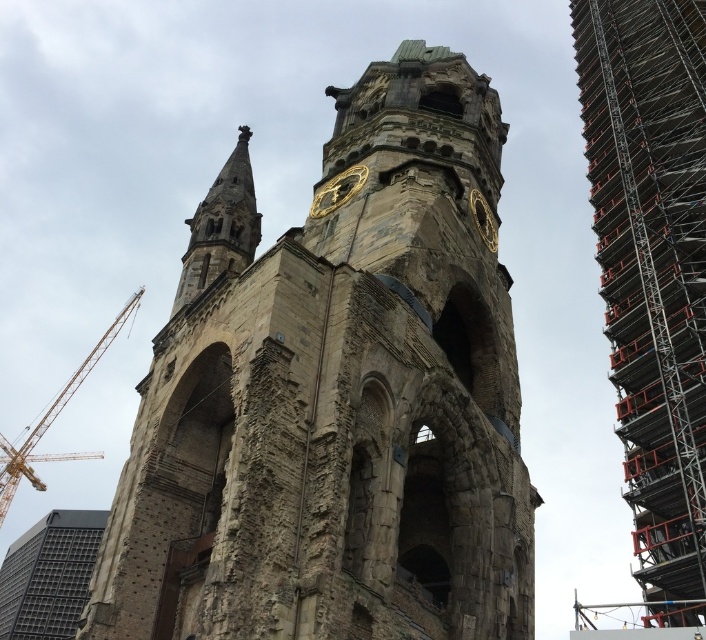
Question: Can you confirm if metallic scaffolding at right is thinner than yellow metal crane at upper left?

Choices:
 (A) no
 (B) yes

Answer: (B)

Question: Which point is farther to the camera?

Choices:
 (A) (100, 353)
 (B) (642, 330)
 (C) (143, 404)

Answer: (A)

Question: Can you confirm if stone tower at center is smaller than gold metallic clock at upper center?

Choices:
 (A) yes
 (B) no

Answer: (B)

Question: Based on their relative distances, which object is farther from the gold metallic clock at upper center?

Choices:
 (A) yellow metal crane at upper left
 (B) metallic scaffolding at right
 (C) stone tower at center

Answer: (A)

Question: Which point is farther to the camera?

Choices:
 (A) gold metallic clock at upper center
 (B) stone tower at center
 (C) metallic scaffolding at right
 (D) yellow metal crane at upper left

Answer: (D)

Question: Can you confirm if stone tower at center is positioned above yellow metal crane at upper left?

Choices:
 (A) no
 (B) yes

Answer: (B)